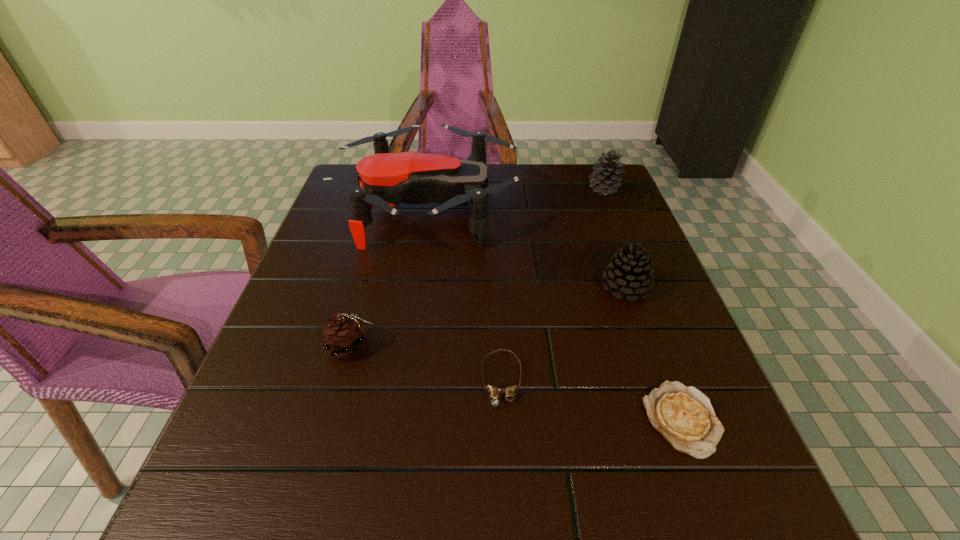
Locate an element on the screen. This screenshot has height=540, width=960. vacant space at the left edge of the desktop is located at coordinates (249, 478).

Image resolution: width=960 pixels, height=540 pixels. Find the location of `vacant area at the right edge of the desktop`. vacant area at the right edge of the desktop is located at coordinates (672, 298).

Locate an element on the screen. Image resolution: width=960 pixels, height=540 pixels. vacant space at the far right corner of the desktop is located at coordinates (588, 176).

The height and width of the screenshot is (540, 960). Find the location of `vacant space at the near right corner of the desktop`. vacant space at the near right corner of the desktop is located at coordinates [x=741, y=522].

This screenshot has width=960, height=540. Identify the location of blank region between the fourth nearest object and the farthest pinecone. (614, 238).

This screenshot has height=540, width=960. Identify the location of unoccupied area between the second farthest pinecone and the fifth tallest object. (564, 334).

The image size is (960, 540). I want to click on free space between the farthest pinecone and the fourth nearest object, so click(614, 238).

Identify the location of vacant space that's between the fifth tallest object and the quiche. This screenshot has height=540, width=960. (591, 399).

Identify the location of empty space that is in between the farthest pinecone and the second nearest pinecone. (614, 238).

The width and height of the screenshot is (960, 540). Find the location of `vacant space that's between the tallest object and the quiche`. vacant space that's between the tallest object and the quiche is located at coordinates (556, 313).